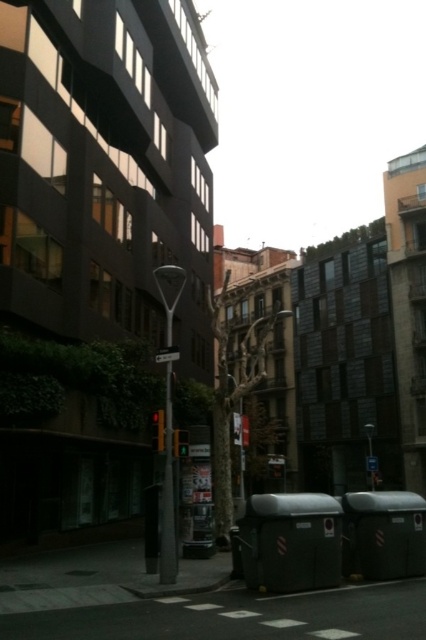
Question: Estimate the real-world distances between objects in this image. Which object is farther from the brown textured tree at center?

Choices:
 (A) metallic streetlight at center
 (B) white plastic street sign at center

Answer: (B)

Question: Does metallic streetlight at center come behind white plastic street sign at center?

Choices:
 (A) yes
 (B) no

Answer: (B)

Question: Among these points, which one is farthest from the camera?

Choices:
 (A) (161, 349)
 (B) (222, 330)

Answer: (B)

Question: Is metallic streetlight at center further to the viewer compared to white plastic street sign at center?

Choices:
 (A) no
 (B) yes

Answer: (A)

Question: Is metallic streetlight at center below white plastic street sign at center?

Choices:
 (A) no
 (B) yes

Answer: (A)

Question: Among these points, which one is nearest to the camera?

Choices:
 (A) (176, 353)
 (B) (215, 518)

Answer: (A)